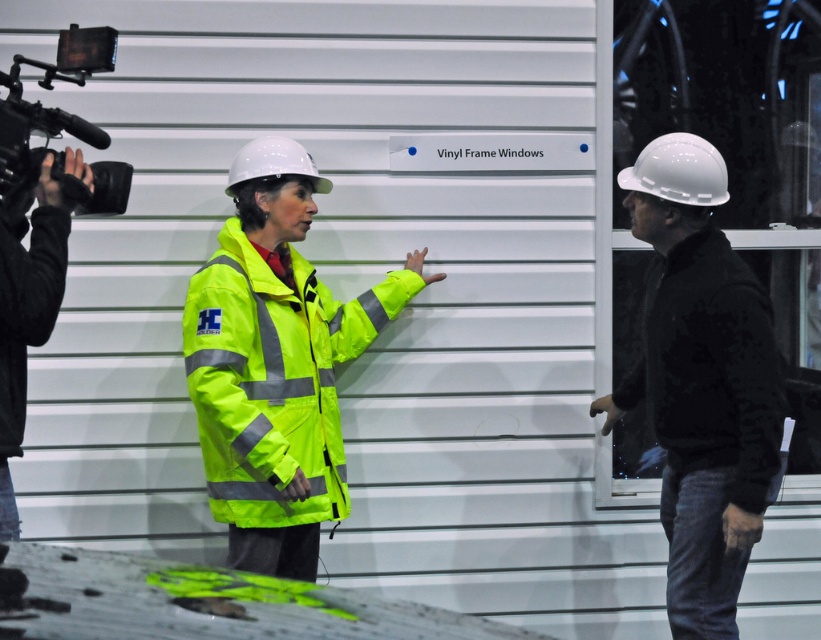
Is black velvet jacket at right shorter than black matte video camera at upper left?

No.

Between black velvet jacket at right and black matte video camera at upper left, which one is positioned higher?

Positioned higher is black matte video camera at upper left.

Does point (728, 372) come behind point (58, 77)?

Yes, point (728, 372) is behind point (58, 77).

The width and height of the screenshot is (821, 640). What are the coordinates of `black velvet jacket at right` in the screenshot? It's located at (709, 368).

Is point (751, 464) positioned behind point (17, 419)?

That is True.

Can you confirm if black velvet jacket at right is thinner than black fabric camera at left?

No.

Locate an element on the screen. The height and width of the screenshot is (640, 821). black velvet jacket at right is located at coordinates (709, 368).

Is black fabric camera at left closer to the viewer compared to black matte video camera at upper left?

Yes.

Is point (21, 291) positioned behind point (1, 108)?

No, it is not.

Where is `black fabric camera at left`? The image size is (821, 640). black fabric camera at left is located at coordinates (26, 317).